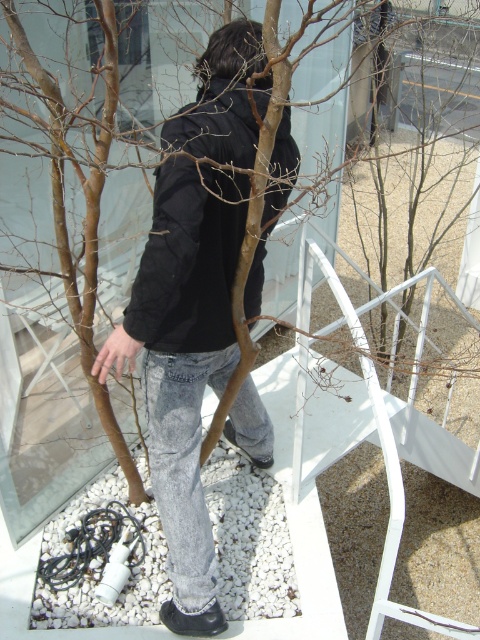
Who is more forward, (186, 504) or (167, 145)?

Point (167, 145) is in front.

Where is `black matte jacket at center`? This screenshot has height=640, width=480. black matte jacket at center is located at coordinates (183, 362).

Describe the element at coordinates (183, 362) in the screenshot. The image size is (480, 640). I see `black matte jacket at center` at that location.

Locate an element on the screen. Image resolution: width=480 pixels, height=640 pixels. black matte jacket at center is located at coordinates (183, 362).